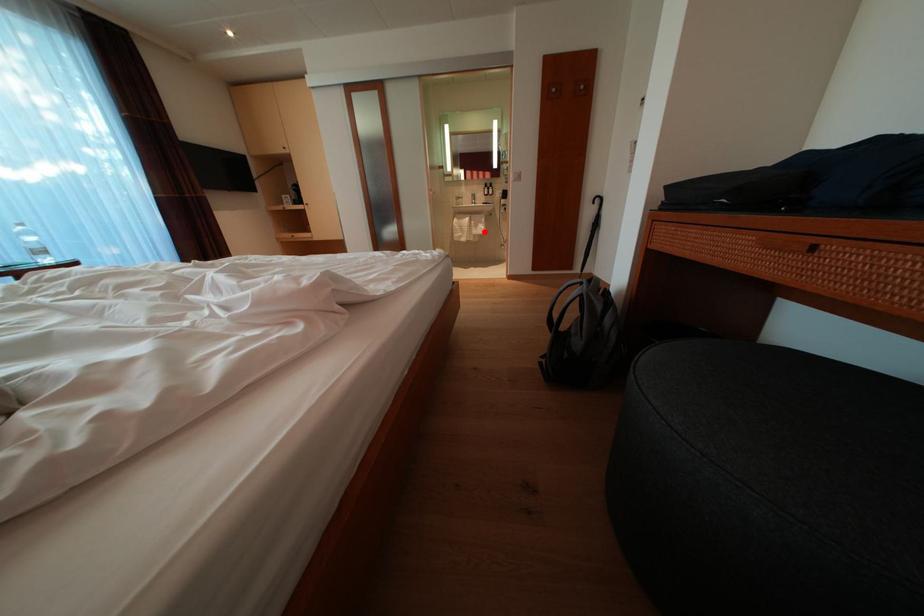
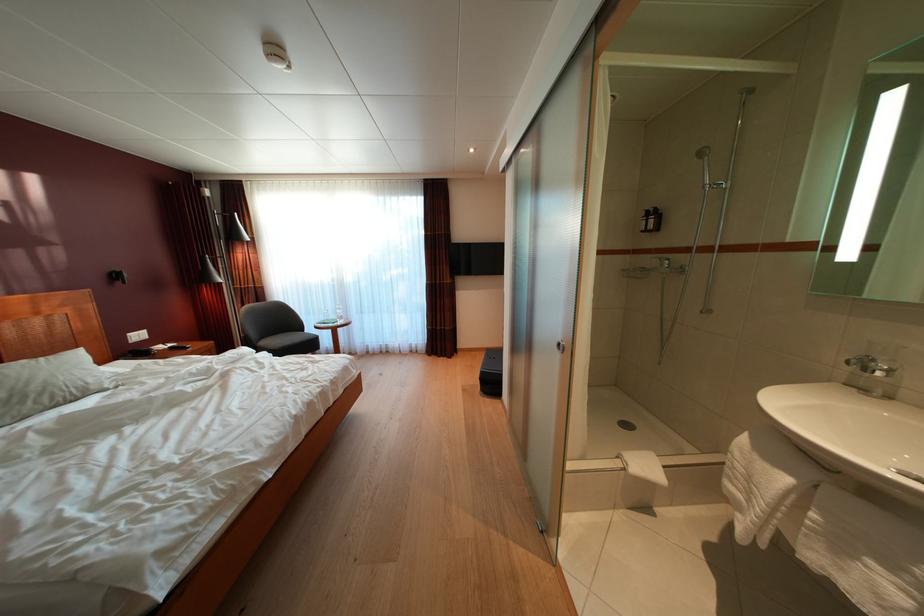
Question: A red point is marked in image1. In image2, is the corresponding 3D point closer to the camera or farther? Reply with the corresponding letter.

Choices:
 (A) The corresponding 3D point is closer.
 (B) The corresponding 3D point is farther.

Answer: (B)